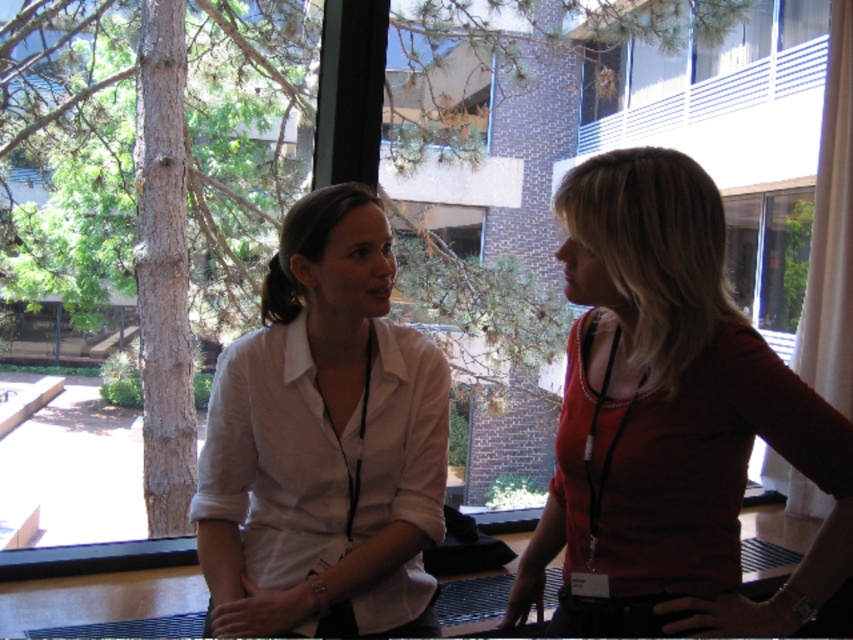
Question: Which of the following is the farthest from the observer?

Choices:
 (A) (434, 486)
 (B) (810, 465)

Answer: (A)

Question: Can you confirm if matte red blouse at right is positioned to the right of white matte shirt at center?

Choices:
 (A) yes
 (B) no

Answer: (A)

Question: Which of the following is the farthest from the observer?

Choices:
 (A) (622, 244)
 (B) (352, 314)

Answer: (B)

Question: Where is matte red blouse at right located in relation to white matte shirt at center in the image?

Choices:
 (A) above
 (B) below

Answer: (B)

Question: Which of the following is the closest to the observer?

Choices:
 (A) white matte shirt at center
 (B) matte red blouse at right

Answer: (B)

Question: Is the position of matte red blouse at right less distant than that of white matte shirt at center?

Choices:
 (A) yes
 (B) no

Answer: (A)